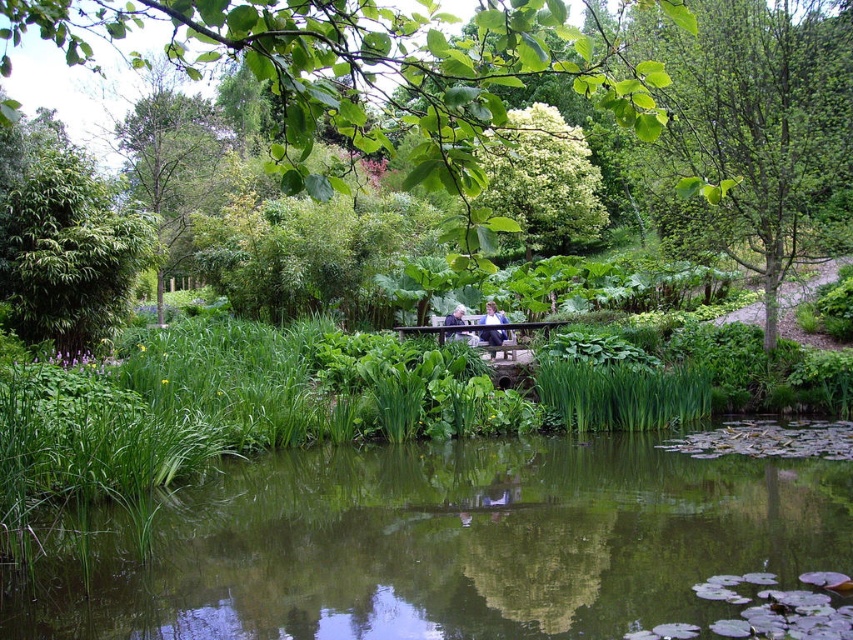
Question: Can you confirm if green leafy tree at upper center is smaller than green leafy tree at center?

Choices:
 (A) yes
 (B) no

Answer: (B)

Question: Among these points, which one is farthest from the camera?

Choices:
 (A) (463, 310)
 (B) (723, 502)
 (C) (491, 339)
 (D) (675, 164)

Answer: (A)

Question: Is green reflective water at center further to the viewer compared to green leafy tree at center?

Choices:
 (A) no
 (B) yes

Answer: (B)

Question: Which point is farther to the camera?

Choices:
 (A) (488, 333)
 (B) (456, 336)
 (C) (627, 104)

Answer: (A)

Question: Is green leafy tree at upper center further to the viewer compared to green leafy tree at center?

Choices:
 (A) yes
 (B) no

Answer: (B)

Question: Which object appears farthest from the camera in this image?

Choices:
 (A) green leafy tree at center
 (B) blue denim jacket at center
 (C) green leafy tree at upper center

Answer: (B)